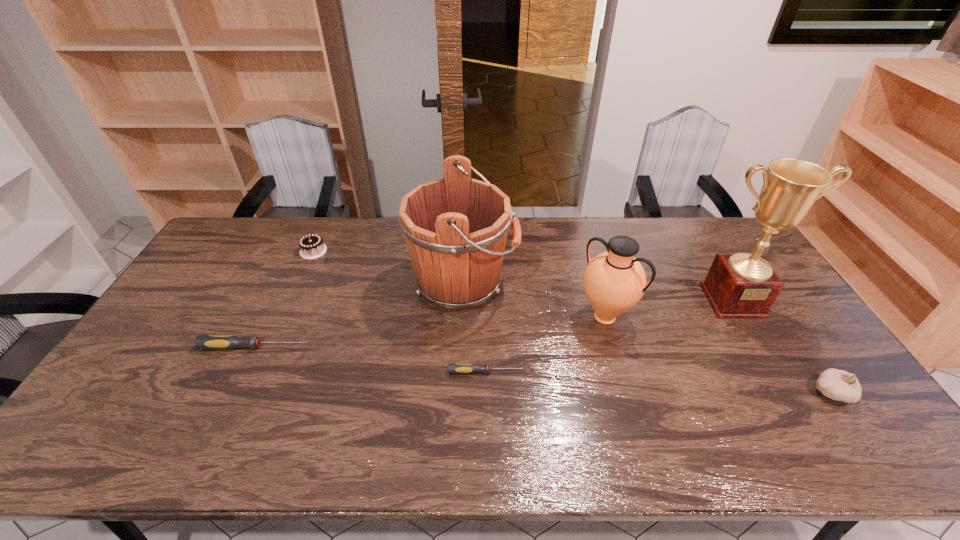
The image size is (960, 540). Find the location of `the fourth shortest object`. the fourth shortest object is located at coordinates coord(838,385).

Identify the location of vacant space located insert the second shortest object into a screw head. (426, 347).

Find the location of a particular element. The width and height of the screenshot is (960, 540). free point located insert the shortest object into a screw head is located at coordinates (542, 372).

Find the location of a particular element. This screenshot has height=540, width=960. vacant space located 0.060m with the handle on the side of the sixth shortest object is located at coordinates (537, 284).

Image resolution: width=960 pixels, height=540 pixels. Find the location of `free region located 0.050m on the front of the third shortest object`. free region located 0.050m on the front of the third shortest object is located at coordinates (305, 268).

Where is `free space located 0.170m on the right of the third object from right to left`? free space located 0.170m on the right of the third object from right to left is located at coordinates (689, 317).

Locate an element on the screen. The width and height of the screenshot is (960, 540). free region located on the plaque of the tallest object is located at coordinates (775, 371).

Locate an element on the screen. vacant space located on the left of the garlic is located at coordinates (734, 393).

You are a GUI agent. You are given a task and a screenshot of the screen. Output one action in this format:
    pyautogui.click(x=<x>, y=<y>)
    Task: Click on the bucket that is at the far edge
    
    Given the screenshot: What is the action you would take?
    pyautogui.click(x=455, y=228)

This screenshot has height=540, width=960. Identify the location of chocolate cake present at the far edge. (311, 246).